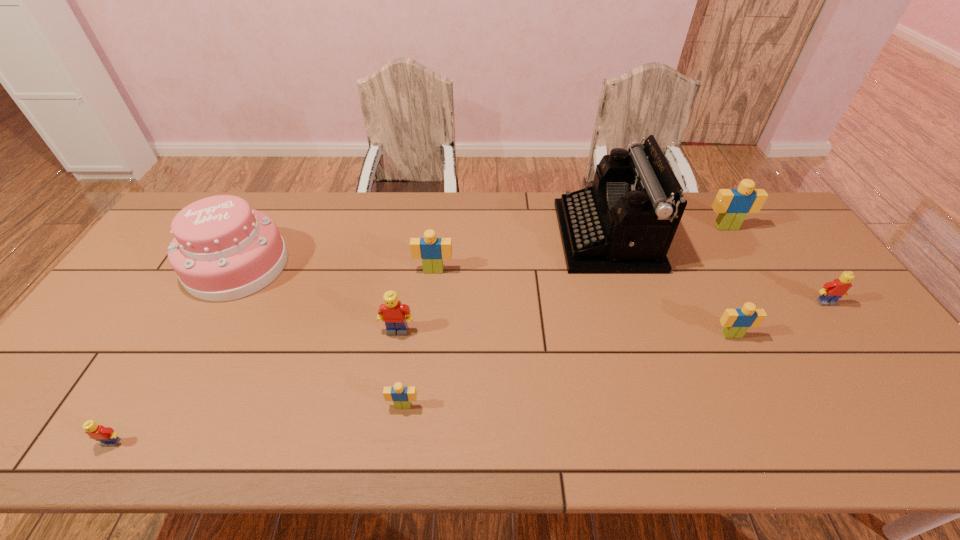
Where is `free point between the eighth farthest object and the second yellow Lego from left to right`? The width and height of the screenshot is (960, 540). free point between the eighth farthest object and the second yellow Lego from left to right is located at coordinates (400, 368).

Where is `free space between the leftmost yellow Lego and the farthest Lego`? This screenshot has width=960, height=540. free space between the leftmost yellow Lego and the farthest Lego is located at coordinates (420, 335).

Locate an element on the screen. The width and height of the screenshot is (960, 540). empty space that is in between the second smallest yellow Lego and the second nearest yellow Lego is located at coordinates point(612,317).

Locate an element on the screen. free spot between the eighth farthest object and the third farthest beige Lego is located at coordinates (567, 370).

Locate an element on the screen. The width and height of the screenshot is (960, 540). vacant space that is in between the eighth farthest object and the fourth object from right to left is located at coordinates (505, 321).

This screenshot has height=540, width=960. I want to click on free spot between the leftmost Lego and the rightmost object, so click(x=468, y=373).

This screenshot has height=540, width=960. Find the location of `vacant area that lies between the birthday cake and the third smallest beige Lego`. vacant area that lies between the birthday cake and the third smallest beige Lego is located at coordinates tap(335, 268).

You are a GUI agent. You are given a task and a screenshot of the screen. Output one action in this format:
    pyautogui.click(x=<x>, y=<y>)
    Task: Click on the vacant space that is in between the second yellow Lego from left to right and the black typewriter
    
    Given the screenshot: What is the action you would take?
    pyautogui.click(x=502, y=284)

Where is `vacant area that lies between the leftmost Lego and the second nearest object`? vacant area that lies between the leftmost Lego and the second nearest object is located at coordinates (257, 424).

Identify the location of object that is the eighth closest one to the seventh object from left to right. (106, 435).